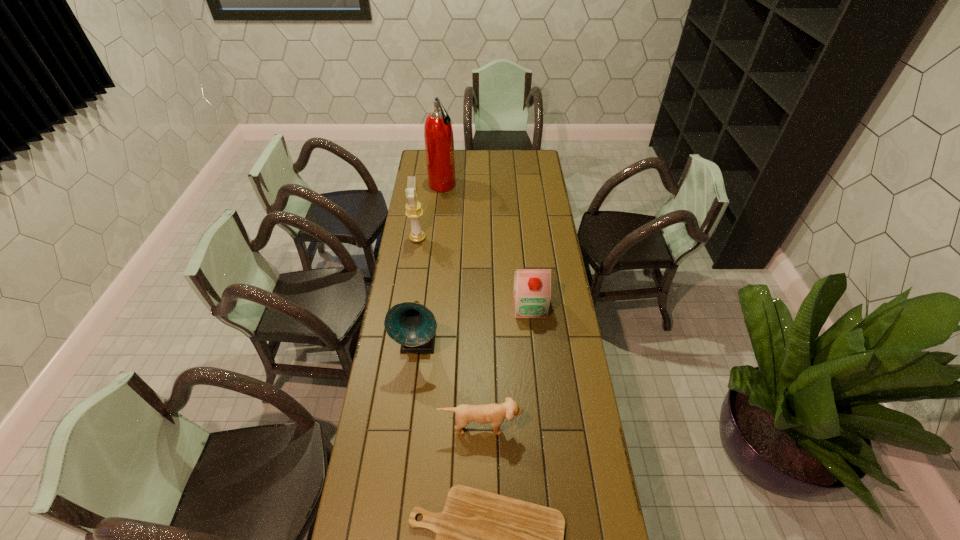
The height and width of the screenshot is (540, 960). Find the location of `the farthest object`. the farthest object is located at coordinates (438, 134).

Identify the location of the tallest object. The image size is (960, 540). (438, 134).

This screenshot has width=960, height=540. Identify the location of award. (414, 211).

In order to click on phonograph_record in this screenshot , I will do `click(411, 324)`.

You are a GUI agent. You are given a task and a screenshot of the screen. Output one action in this format:
    pyautogui.click(x=<x>, y=<y>)
    Task: Click on the third shortest object
    
    Given the screenshot: What is the action you would take?
    pyautogui.click(x=532, y=287)

In order to click on the third farthest object in this screenshot , I will do `click(532, 287)`.

Where is `puppy`? puppy is located at coordinates (494, 413).

Where is `the second nearest object`? The image size is (960, 540). the second nearest object is located at coordinates (494, 413).

The image size is (960, 540). I want to click on vacant region located on the right of the tallest object, so click(x=515, y=186).

Locate an element on the screen. The height and width of the screenshot is (540, 960). vacant area situated on the front-facing side of the award is located at coordinates (464, 238).